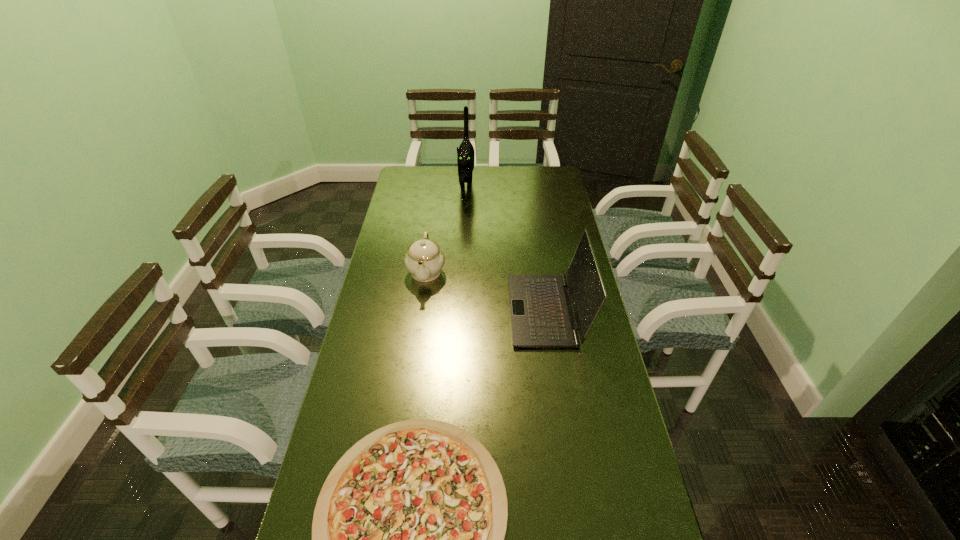
Find the location of a particular element. The height and width of the screenshot is (540, 960). vacant area that lies between the third tallest object and the cat is located at coordinates (446, 230).

At what (x,y) coordinates should I click in order to perform the action: click on blank region between the farthest object and the rightmost object. Please return your answer as a coordinate pair (x, y). The image size is (960, 540). Looking at the image, I should click on (507, 249).

Locate an element on the screen. free area in between the rightmost object and the tallest object is located at coordinates (507, 249).

Locate which object is the closest to the pizza. Please provide its 2D coordinates. Your answer should be formatted as a tuple, i.e. [(x, y)], where the tuple contains the x and y coordinates of a point satisfying the conditions above.

[(542, 316)]

Image resolution: width=960 pixels, height=540 pixels. What are the coordinates of `object identified as the third closest to the rightmost object` in the screenshot? It's located at (465, 153).